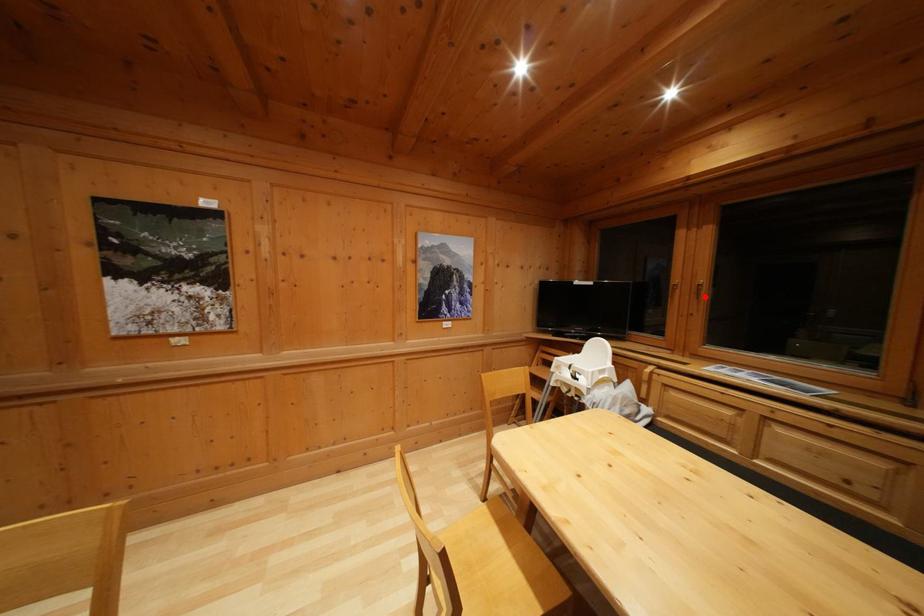
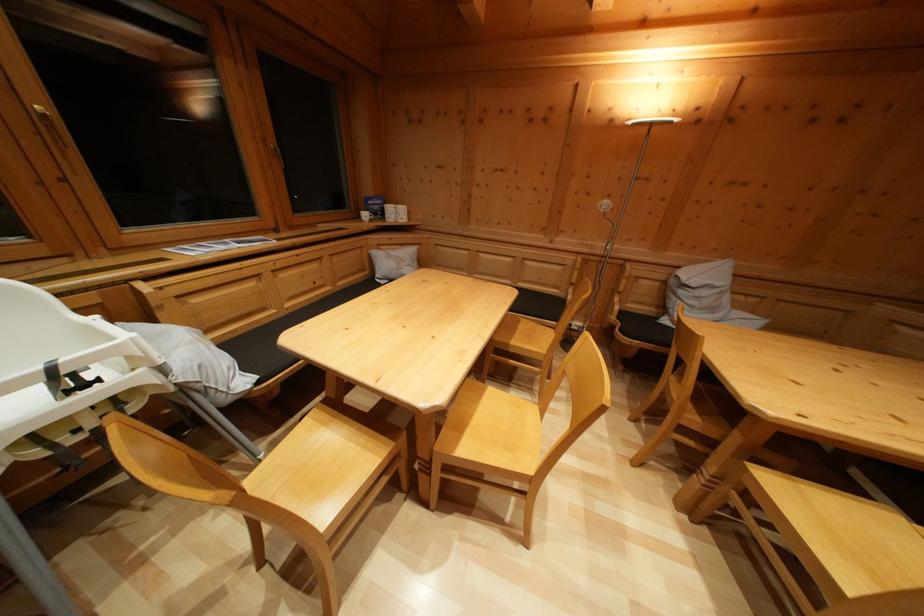
Question: I am providing you with two images of the same scene from different viewpoints. A red point is shown in image1. For the corresponding object point in image2, is it positioned nearer or farther from the camera?

Choices:
 (A) Nearer
 (B) Farther

Answer: (B)